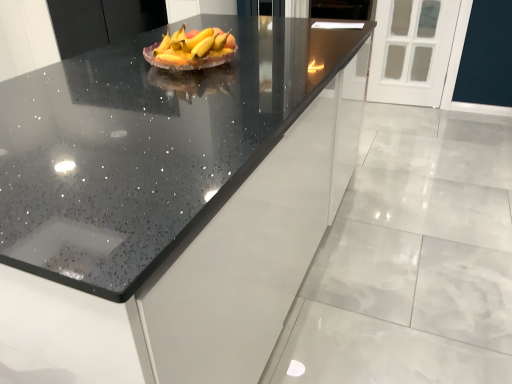
Question: Is yellow matte grapefruit at center shorter than black speckled countertop at center?

Choices:
 (A) yes
 (B) no

Answer: (A)

Question: Would you say yellow matte grapefruit at center is a long distance from black speckled countertop at center?

Choices:
 (A) yes
 (B) no

Answer: (B)

Question: Is the position of yellow matte grapefruit at center less distant than that of black speckled countertop at center?

Choices:
 (A) yes
 (B) no

Answer: (B)

Question: From a real-world perspective, is yellow matte grapefruit at center physically below black speckled countertop at center?

Choices:
 (A) yes
 (B) no

Answer: (B)

Question: From the image's perspective, would you say yellow matte grapefruit at center is positioned over black speckled countertop at center?

Choices:
 (A) yes
 (B) no

Answer: (A)

Question: Would you say black speckled countertop at center is inside or outside yellow matte grapefruit at center?

Choices:
 (A) inside
 (B) outside

Answer: (B)

Question: Does point (157, 246) appear closer or farther from the camera than point (176, 48)?

Choices:
 (A) farther
 (B) closer

Answer: (B)

Question: Looking at the image, does black speckled countertop at center seem bigger or smaller compared to yellow matte grapefruit at center?

Choices:
 (A) big
 (B) small

Answer: (A)

Question: Would you say black speckled countertop at center is to the left or to the right of yellow matte grapefruit at center in the picture?

Choices:
 (A) right
 (B) left

Answer: (B)

Question: From a real-world perspective, is black speckled countertop at center above or below black speckled countertop at center?

Choices:
 (A) above
 (B) below

Answer: (B)

Question: Considering the relative positions of black speckled countertop at center and black speckled countertop at center in the image provided, is black speckled countertop at center to the left or to the right of black speckled countertop at center?

Choices:
 (A) right
 (B) left

Answer: (A)

Question: From the image's perspective, is black speckled countertop at center above or below black speckled countertop at center?

Choices:
 (A) below
 (B) above

Answer: (A)

Question: From their relative heights in the image, would you say black speckled countertop at center is taller or shorter than black speckled countertop at center?

Choices:
 (A) tall
 (B) short

Answer: (A)

Question: From the image's perspective, is yellow matte grapefruit at center positioned above or below black speckled countertop at center?

Choices:
 (A) above
 (B) below

Answer: (A)

Question: Based on their sizes in the image, would you say yellow matte grapefruit at center is bigger or smaller than black speckled countertop at center?

Choices:
 (A) big
 (B) small

Answer: (B)